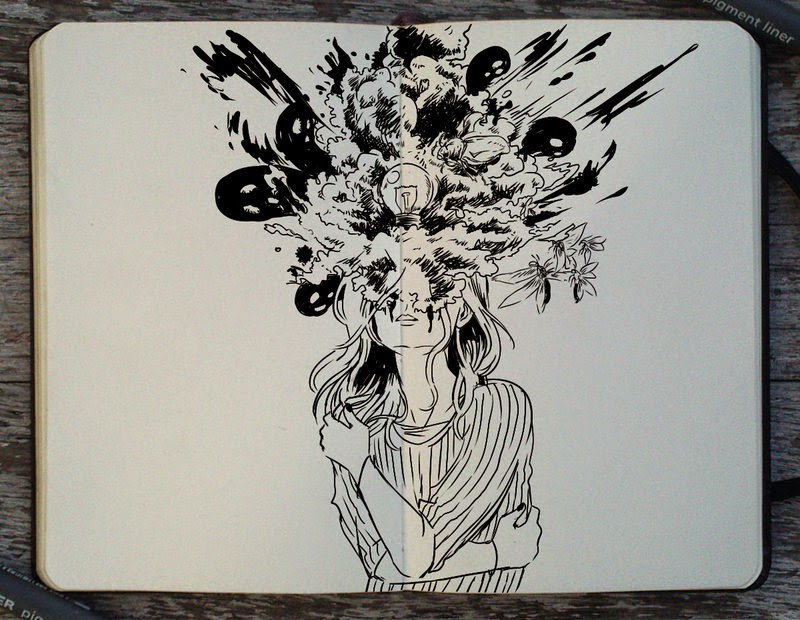
Where is `blank journal`? The width and height of the screenshot is (800, 620). blank journal is located at coordinates (216, 296), (668, 462).